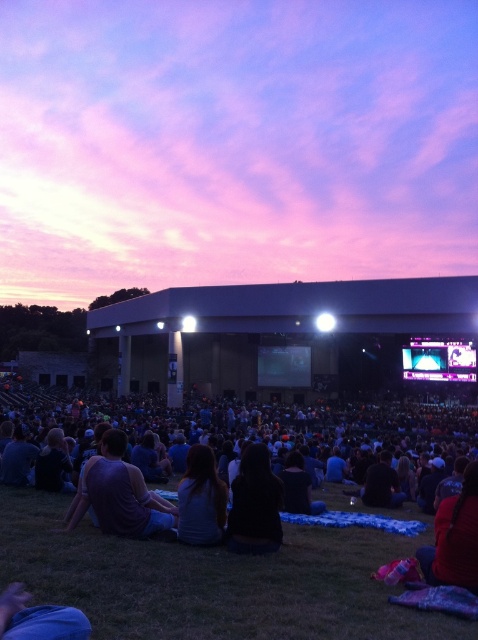
You are a photographer at the concert and want to capture a photo of the silky brown hair at center and the matte black screen at center in the same frame. Based on their positions, which object should you adjust your camera to focus on first to ensure both are in the shot?

The silky brown hair at center is to the left of matte black screen at center, so you should focus on the matte black screen at center first as it is on the right side, allowing the camera to capture both objects in the frame.